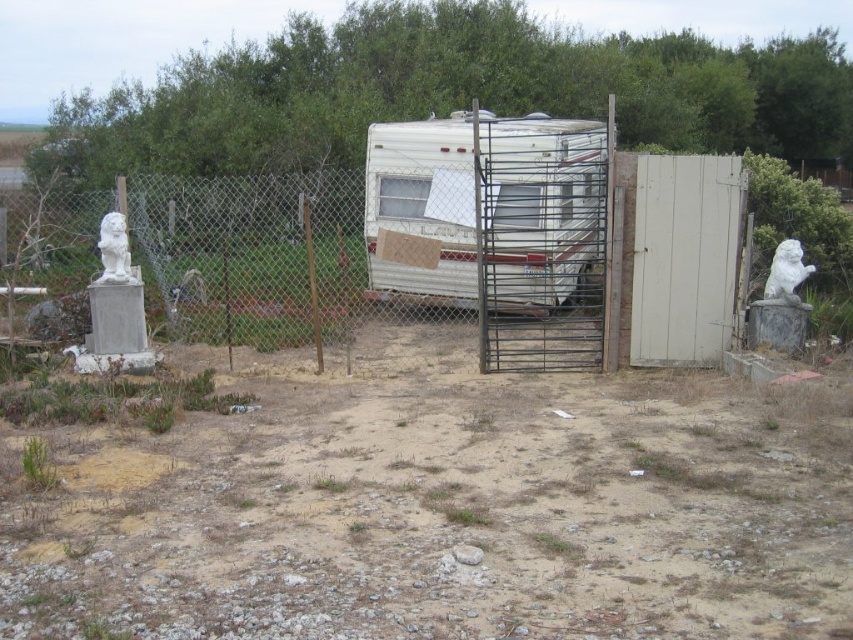
Between white stone lion at right and white marble lion at left, which one is positioned lower?

white stone lion at right is below.

Does white stone lion at right appear under white marble lion at left?

Yes.

This screenshot has height=640, width=853. Describe the element at coordinates (786, 272) in the screenshot. I see `white stone lion at right` at that location.

You are a GUI agent. You are given a task and a screenshot of the screen. Output one action in this format:
    pyautogui.click(x=<x>, y=<y>)
    Task: Click on the white stone lion at right
    The height and width of the screenshot is (640, 853).
    Given the screenshot: What is the action you would take?
    pyautogui.click(x=786, y=272)

This screenshot has height=640, width=853. What do you see at coordinates (445, 509) in the screenshot?
I see `dull brown dirt at center` at bounding box center [445, 509].

Does point (830, 596) come in front of point (550, 180)?

Yes, it is in front of point (550, 180).

The width and height of the screenshot is (853, 640). What are the coordinates of `dull brown dirt at center` in the screenshot? It's located at (445, 509).

Is metallic chain-link fence at left shorter than metallic gate at center?

Correct, metallic chain-link fence at left is not as tall as metallic gate at center.

Who is positioned more to the left, metallic chain-link fence at left or metallic gate at center?

Positioned to the left is metallic chain-link fence at left.

Who is more distant from viewer, (268, 266) or (579, 193)?

Point (579, 193)

I want to click on metallic chain-link fence at left, so click(250, 253).